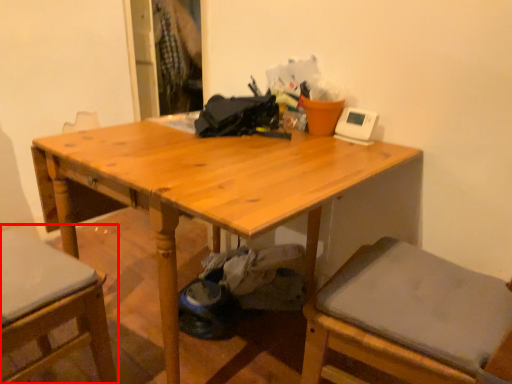
Question: In this image, where is chair (annotated by the red box) located relative to table?

Choices:
 (A) right
 (B) left

Answer: (B)